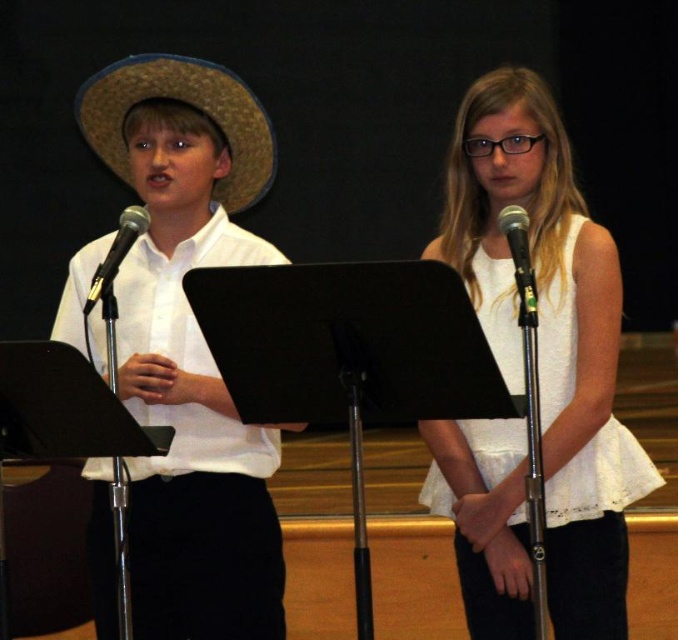
You are a sound technician setting up for a live performance. You have two microphones to place on stage. The black metallic microphone at left and the black metallic microphone at right. Given that the stage has limited space, which microphone should you choose to place closer to the edge to ensure it doesn,t fall off?

The black metallic microphone at right has a smaller width than the black metallic microphone at left, so it is more stable and less likely to fall off the edge. Therefore, you should place the black metallic microphone at right closer to the edge.

You are a stagehand who needs to move a 70 cm wide equipment box between the matte straw hat at left and the white cotton dress at center. Can you fit the box between them?

The matte straw hat at left and white cotton dress at center are 67.35 centimeters apart from each other. Since the equipment box is 70 cm wide, it cannot fit between them as the space is narrower than the box.